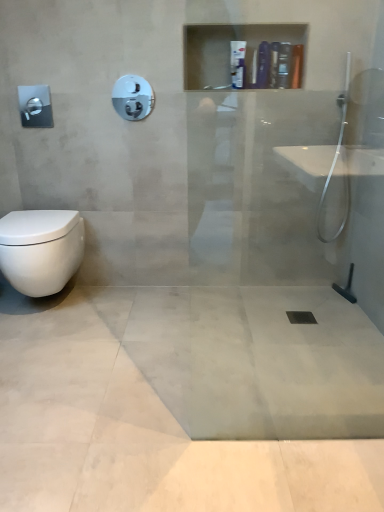
Question: From a real-world perspective, is satin nickel showerhead at upper left positioned over white glossy bottle at upper center, the 4th toiletry in the right-to-left sequence, based on gravity?

Choices:
 (A) no
 (B) yes

Answer: (A)

Question: From the image's perspective, is satin nickel showerhead at upper left located beneath white glossy bottle at upper center, which is counted as the 2th toiletry, starting from the left?

Choices:
 (A) no
 (B) yes

Answer: (B)

Question: Is satin nickel showerhead at upper left closer to camera compared to white glossy bottle at upper center, which is counted as the 2th toiletry, starting from the left?

Choices:
 (A) yes
 (B) no

Answer: (B)

Question: From the image's perspective, is satin nickel showerhead at upper left on white glossy bottle at upper center, the 4th toiletry in the right-to-left sequence?

Choices:
 (A) no
 (B) yes

Answer: (A)

Question: Considering the relative sizes of satin nickel showerhead at upper left and white glossy bottle at upper center, which is counted as the 2th toiletry, starting from the left, in the image provided, is satin nickel showerhead at upper left smaller than white glossy bottle at upper center, which is counted as the 2th toiletry, starting from the left,?

Choices:
 (A) no
 (B) yes

Answer: (B)

Question: Looking at their shapes, would you say satin nickel showerhead at upper left is wider or thinner than matte orange tube at upper center, which appears as the first toiletry when viewed from the right?

Choices:
 (A) wide
 (B) thin

Answer: (B)

Question: Is satin nickel showerhead at upper left to the left or to the right of matte orange tube at upper center, which appears as the first toiletry when viewed from the right, in the image?

Choices:
 (A) left
 (B) right

Answer: (A)

Question: Is satin nickel showerhead at upper left bigger or smaller than matte orange tube at upper center, the 5th toiletry when ordered from left to right?

Choices:
 (A) small
 (B) big

Answer: (A)

Question: From a real-world perspective, is satin nickel showerhead at upper left above or below matte orange tube at upper center, which appears as the first toiletry when viewed from the right?

Choices:
 (A) below
 (B) above

Answer: (A)

Question: Would you say matte orange tube at upper center, the 5th toiletry when ordered from left to right, is to the left or to the right of white glossy toilet at lower left in the picture?

Choices:
 (A) right
 (B) left

Answer: (A)

Question: Is matte orange tube at upper center, which appears as the first toiletry when viewed from the right, inside or outside of white glossy toilet at lower left?

Choices:
 (A) outside
 (B) inside

Answer: (A)

Question: Is matte orange tube at upper center, which appears as the first toiletry when viewed from the right, in front of or behind white glossy toilet at lower left in the image?

Choices:
 (A) behind
 (B) front

Answer: (A)

Question: Considering the positions of point (299, 87) and point (72, 215), is point (299, 87) closer or farther from the camera than point (72, 215)?

Choices:
 (A) farther
 (B) closer

Answer: (B)

Question: Considering the relative positions of light gray concrete at center and matte black soap dispenser at upper center, which ranks as the second toiletry in right-to-left order, in the image provided, is light gray concrete at center to the left or to the right of matte black soap dispenser at upper center, which ranks as the second toiletry in right-to-left order,?

Choices:
 (A) left
 (B) right

Answer: (A)

Question: From the image's perspective, is light gray concrete at center above or below matte black soap dispenser at upper center, arranged as the 4th toiletry when viewed from the left?

Choices:
 (A) below
 (B) above

Answer: (A)